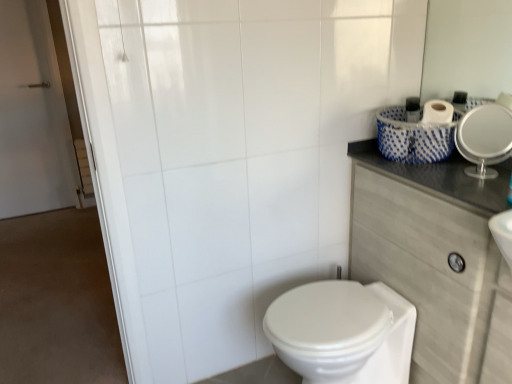
Question: Does white glossy bidet at lower center come in front of white glossy mirror at upper right?

Choices:
 (A) no
 (B) yes

Answer: (B)

Question: From a real-world perspective, is white glossy bidet at lower center under white glossy mirror at upper right?

Choices:
 (A) no
 (B) yes

Answer: (B)

Question: Can you confirm if white glossy bidet at lower center is positioned to the left of white glossy mirror at upper right?

Choices:
 (A) no
 (B) yes

Answer: (B)

Question: Does white glossy bidet at lower center come behind white glossy mirror at upper right?

Choices:
 (A) yes
 (B) no

Answer: (B)

Question: Is white glossy bidet at lower center completely or partially outside of white glossy mirror at upper right?

Choices:
 (A) no
 (B) yes

Answer: (B)

Question: Is white glossy mirror at upper right taller or shorter than white glossy bidet at lower center?

Choices:
 (A) tall
 (B) short

Answer: (B)

Question: Considering the positions of white glossy mirror at upper right and white glossy bidet at lower center in the image, is white glossy mirror at upper right wider or thinner than white glossy bidet at lower center?

Choices:
 (A) thin
 (B) wide

Answer: (A)

Question: Visually, is white glossy mirror at upper right positioned to the left or to the right of white glossy bidet at lower center?

Choices:
 (A) left
 (B) right

Answer: (B)

Question: Based on their sizes in the image, would you say white glossy mirror at upper right is bigger or smaller than white glossy bidet at lower center?

Choices:
 (A) small
 (B) big

Answer: (A)

Question: From a real-world perspective, is dark gray laminate counter top at upper right positioned above or below white glossy bidet at lower center?

Choices:
 (A) below
 (B) above

Answer: (B)

Question: From the image's perspective, relative to white glossy bidet at lower center, is dark gray laminate counter top at upper right above or below?

Choices:
 (A) above
 (B) below

Answer: (A)

Question: Would you say dark gray laminate counter top at upper right is to the left or to the right of white glossy bidet at lower center in the picture?

Choices:
 (A) right
 (B) left

Answer: (A)

Question: In the image, is dark gray laminate counter top at upper right positioned in front of or behind white glossy bidet at lower center?

Choices:
 (A) front
 (B) behind

Answer: (A)

Question: Is point (439, 326) closer or farther from the camera than point (489, 117)?

Choices:
 (A) farther
 (B) closer

Answer: (B)

Question: Considering the positions of dark gray laminate counter top at upper right and white glossy mirror at upper right in the image, is dark gray laminate counter top at upper right wider or thinner than white glossy mirror at upper right?

Choices:
 (A) wide
 (B) thin

Answer: (A)